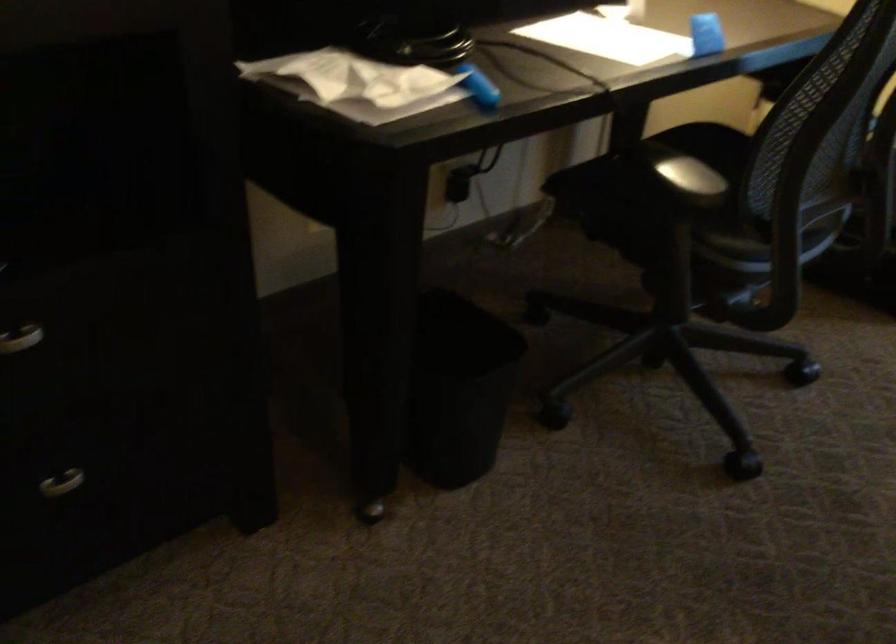
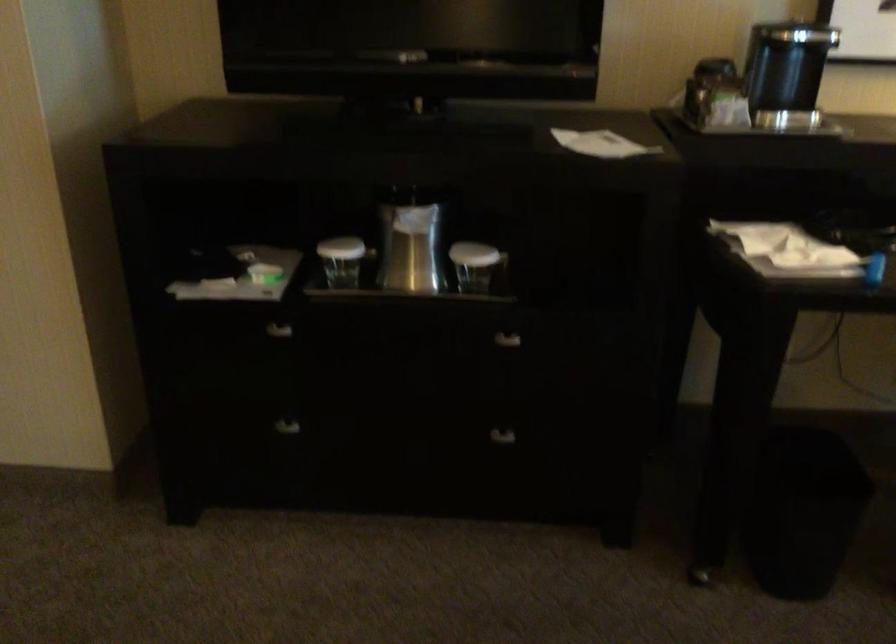
Find the pixel in the second image that matches pixel 375 507 in the first image.

(701, 574)